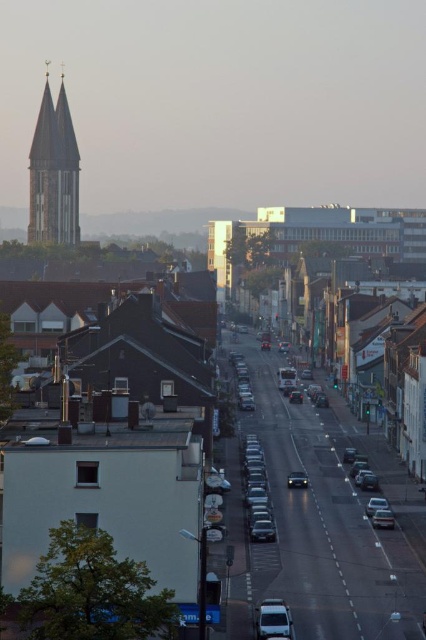
Which is below, dark gray stone tower at left or silver metallic van at center?

Positioned lower is silver metallic van at center.

Is point (42, 196) less distant than point (276, 602)?

No.

Is point (40, 100) positioned behind point (261, 621)?

Yes, it is behind point (261, 621).

Locate an element on the screen. The image size is (426, 640). dark gray stone tower at left is located at coordinates (54, 173).

Between silver metallic van at center and metallic silver sedan at center, which one appears on the left side from the viewer's perspective?

silver metallic van at center

Who is shorter, silver metallic van at center or metallic silver sedan at center?

Standing shorter between the two is metallic silver sedan at center.

The height and width of the screenshot is (640, 426). I want to click on silver metallic van at center, so (x=273, y=620).

Can you confirm if silver metallic van at center is positioned to the right of shiny silver sedan at center?

No, silver metallic van at center is not to the right of shiny silver sedan at center.

Between point (258, 618) and point (294, 474), which one is positioned in front?

Point (258, 618) is in front.

Which is in front, point (290, 632) or point (290, 486)?

Point (290, 632) is more forward.

Where is `silver metallic van at center`? This screenshot has height=640, width=426. silver metallic van at center is located at coordinates (273, 620).